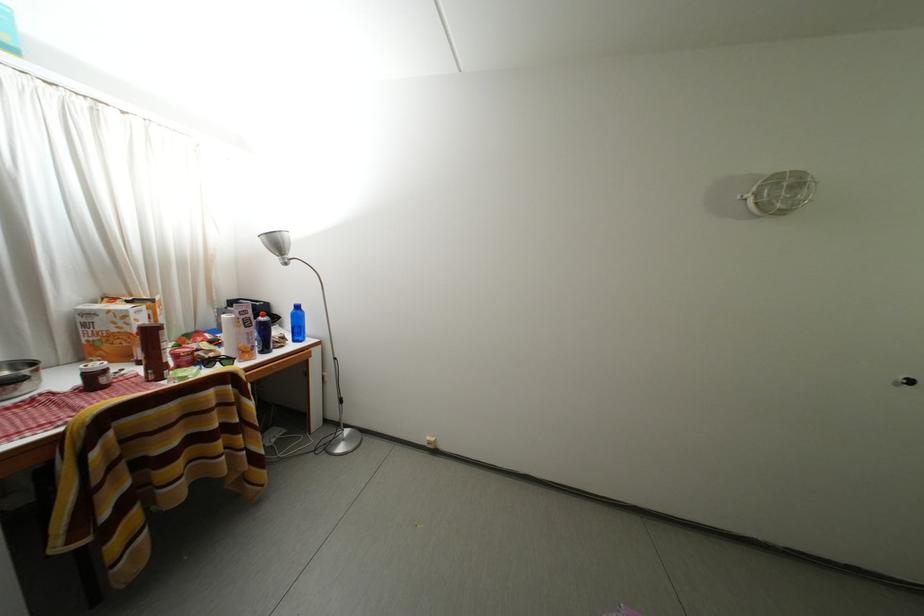
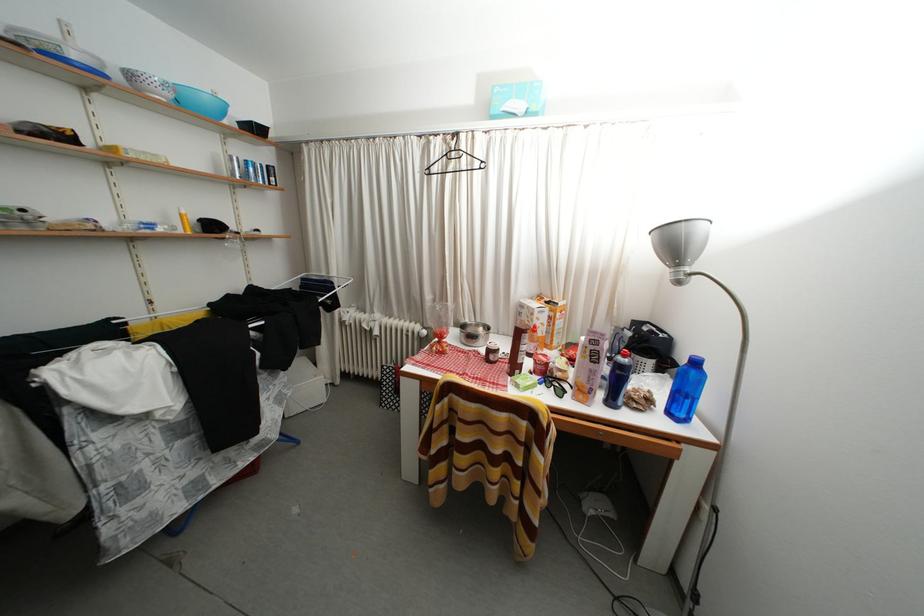
The point at (285, 249) is marked in the first image. Where is the corresponding point in the second image?

(681, 251)